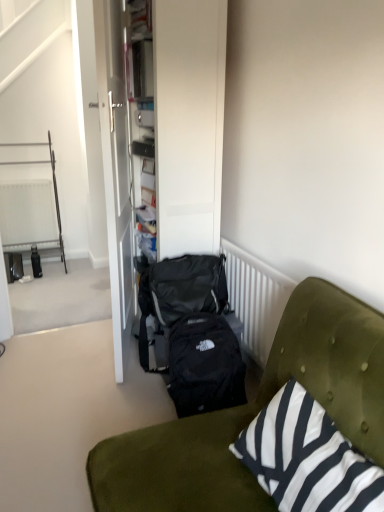
Image resolution: width=384 pixels, height=512 pixels. I want to click on blank space to the left of white glossy door at center, so click(59, 356).